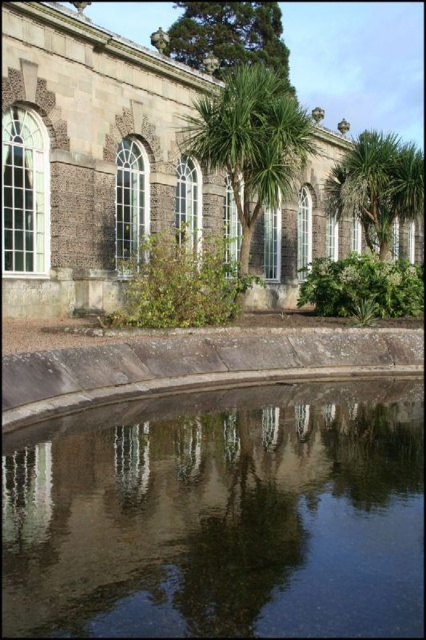
Based on the photo, you are a landscape architect designing a new garden. You have two green leafy trees available to place in the garden. The green leafy palm tree at right and the green leafy tree at upper center. Which tree should you choose if you want a larger tree in the garden?

The green leafy palm tree at right has a larger size compared to the green leafy tree at upper center, so you should choose the green leafy palm tree at right for a larger tree in the garden.

Looking at this image, you are standing at the entrance of the stone building and see two points marked in the garden. The first point is at coordinate point(408, 214) and the second is at point(209, 20). Which point is closer to the building?

Point(209, 20) is closer to the building because it is behind point(408, 214), which is in front of it.